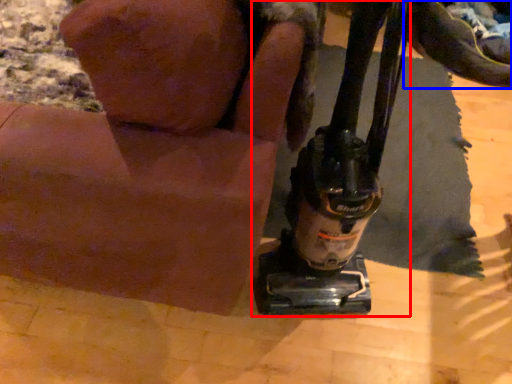
Question: Which object is closer to the camera taking this photo, sewing machine (highlighted by a red box) or footwear (highlighted by a blue box)?

Choices:
 (A) sewing machine
 (B) footwear

Answer: (A)